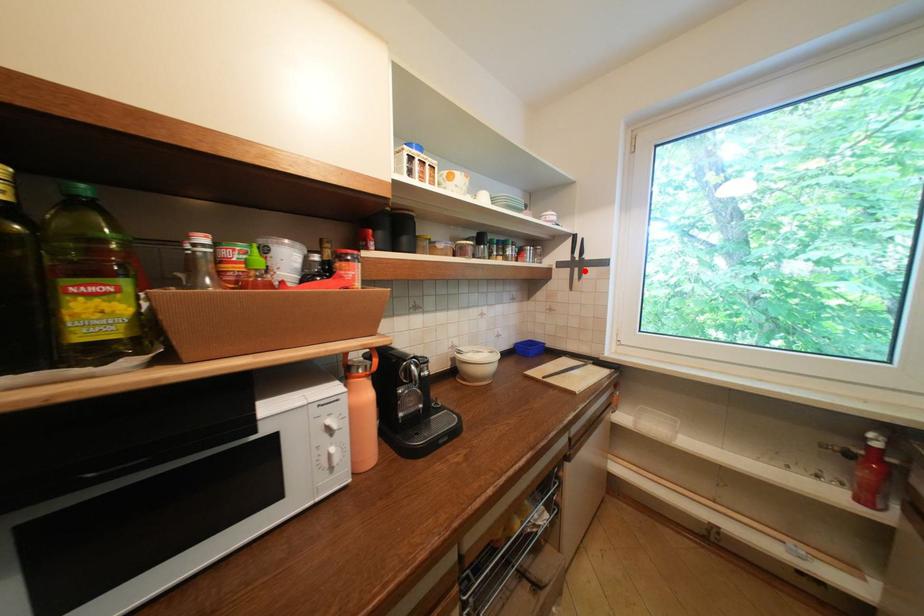
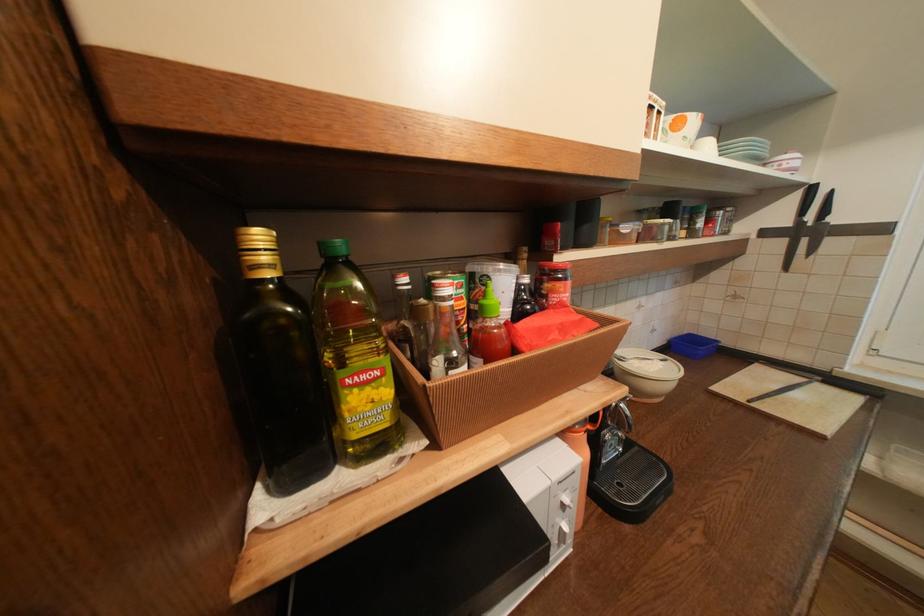
Find the pixel in the second image that matches the highlighted location in the first image.

(812, 241)